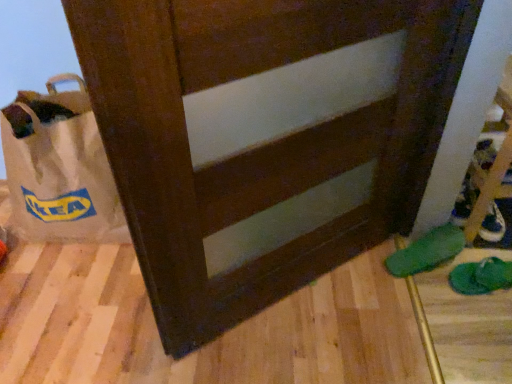
In order to click on vacant area that is in front of green fabric slipper at lower right, positioned as the 1th footwear in right-to-left order in this screenshot , I will do coord(488,320).